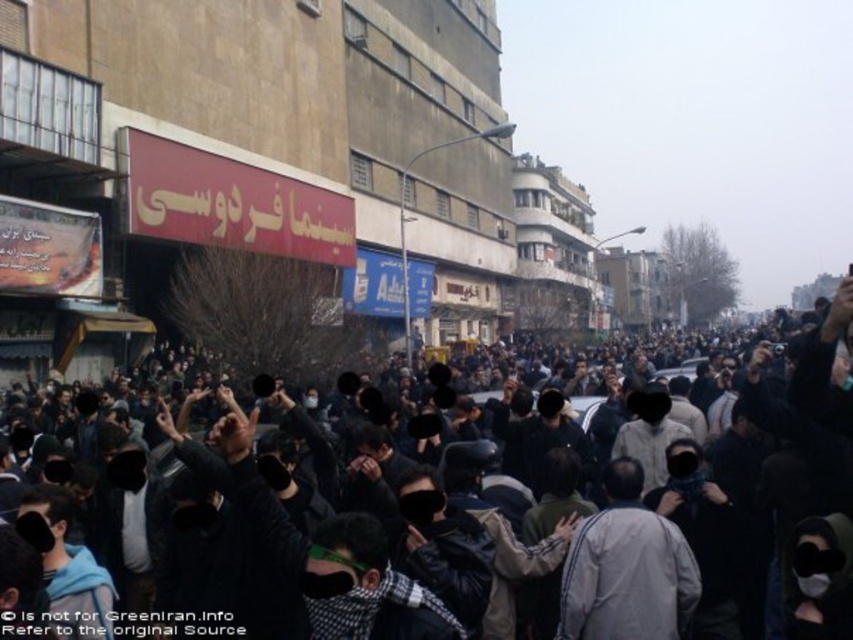
Does point (149, 512) lie in front of point (587, 579)?

No, (149, 512) is further to viewer.

Can you confirm if dark clothing crowd at center is positioned to the right of light gray fabric jacket at center?

In fact, dark clothing crowd at center is to the left of light gray fabric jacket at center.

Between point (624, 518) and point (576, 611), which one is positioned in front?

Point (576, 611)

Where is `dark clothing crowd at center`? dark clothing crowd at center is located at coordinates (424, 541).